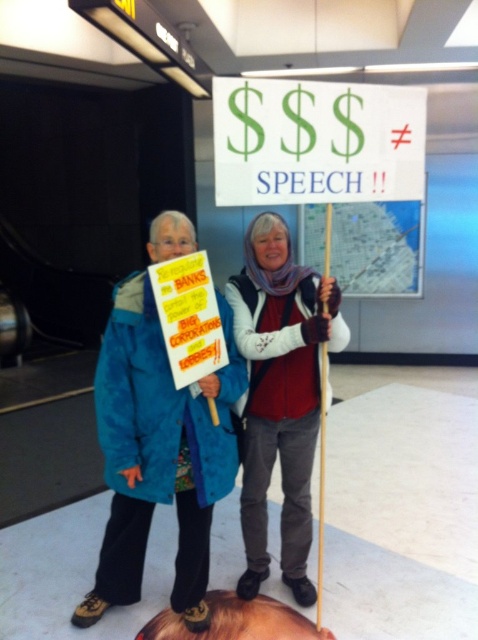
Question: Is blue fabric jacket at left positioned at the back of matte white scarf at center?

Choices:
 (A) yes
 (B) no

Answer: (B)

Question: Can you confirm if blue fabric jacket at left is bigger than matte white scarf at center?

Choices:
 (A) no
 (B) yes

Answer: (B)

Question: Which point is farther to the camera?

Choices:
 (A) matte white scarf at center
 (B) blue fabric jacket at left

Answer: (A)

Question: Is blue fabric jacket at left positioned behind matte white scarf at center?

Choices:
 (A) no
 (B) yes

Answer: (A)

Question: Among these objects, which one is farthest from the camera?

Choices:
 (A) blue fabric jacket at left
 (B) matte white scarf at center

Answer: (B)

Question: Which object appears closest to the camera in this image?

Choices:
 (A) matte white scarf at center
 (B) blue fabric jacket at left

Answer: (B)